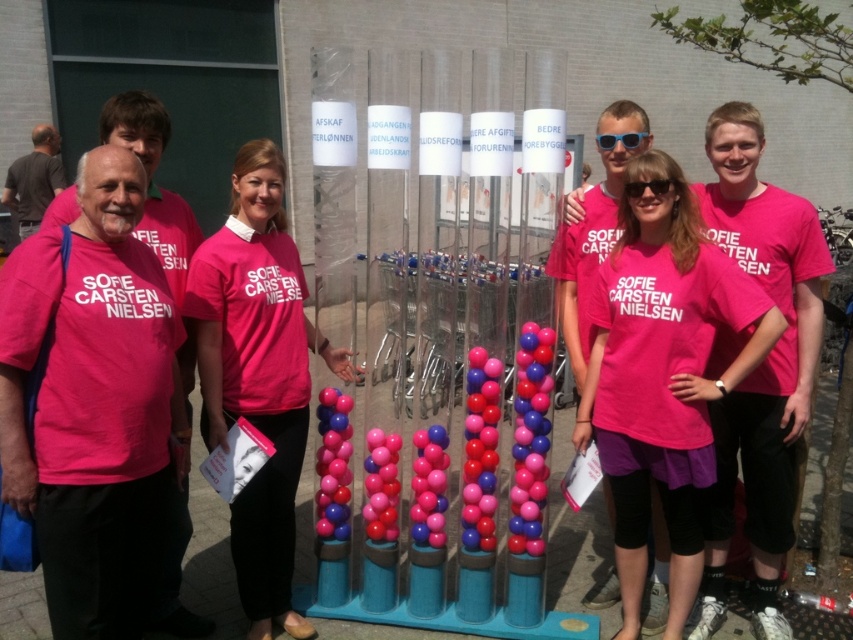
Question: Among these objects, which one is nearest to the camera?

Choices:
 (A) pink fabric shirt at center
 (B) pink matte shirt at center

Answer: (B)

Question: Is pink matte shirt at center bigger than pink fabric shirt at center?

Choices:
 (A) yes
 (B) no

Answer: (A)

Question: Considering the relative positions of pink matte shirt at center and pink fabric shirt at center in the image provided, where is pink matte shirt at center located with respect to pink fabric shirt at center?

Choices:
 (A) below
 (B) above

Answer: (A)

Question: Does pink matte shirt at center have a greater width compared to pink fabric shirt at center?

Choices:
 (A) no
 (B) yes

Answer: (B)

Question: Which of the following is the farthest from the observer?

Choices:
 (A) (271, 349)
 (B) (653, 291)

Answer: (A)